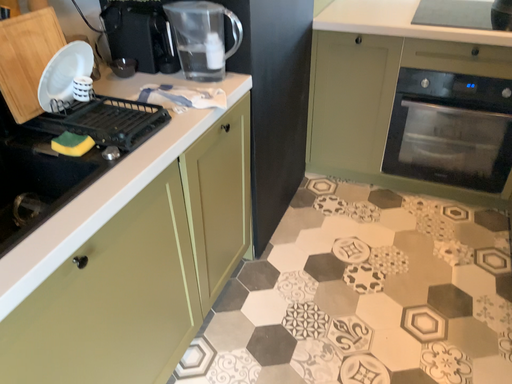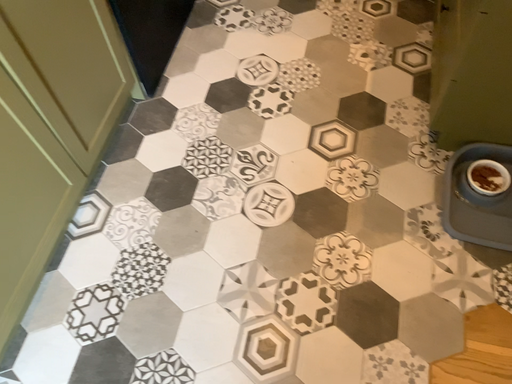
Question: Which way did the camera rotate in the video?

Choices:
 (A) rotated right
 (B) rotated left

Answer: (A)